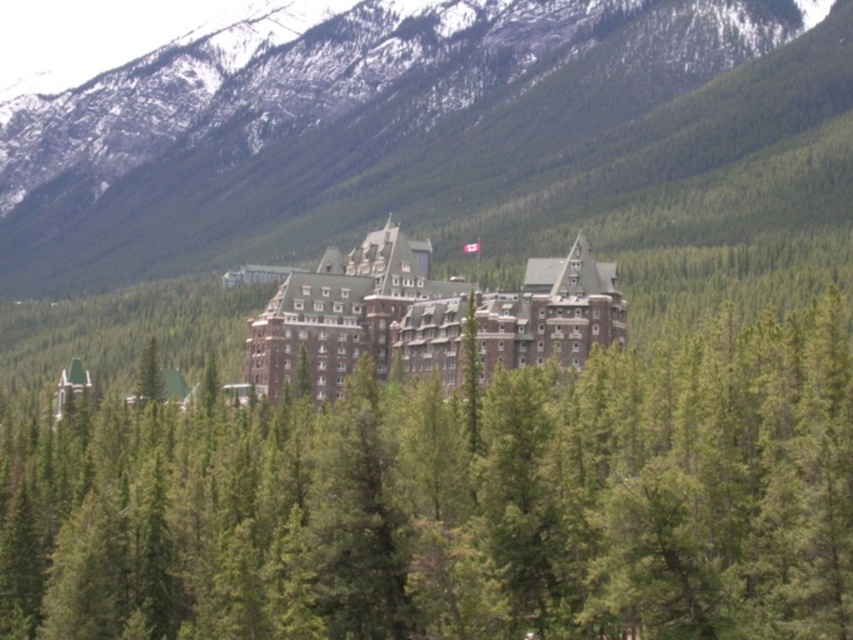
Question: Is green forested mountain at upper center to the right of brown brick hotel at center from the viewer's perspective?

Choices:
 (A) yes
 (B) no

Answer: (B)

Question: Which point is closer to the camera?

Choices:
 (A) (260, 182)
 (B) (44, 440)
 (C) (440, 300)

Answer: (B)

Question: Which of the following is the closest to the observer?

Choices:
 (A) green textured tree at center
 (B) brown brick hotel at center

Answer: (A)

Question: Is green textured tree at center further to the viewer compared to brown brick hotel at center?

Choices:
 (A) no
 (B) yes

Answer: (A)

Question: Among these objects, which one is nearest to the camera?

Choices:
 (A) green textured tree at center
 (B) brown brick hotel at center

Answer: (A)

Question: Can you confirm if green textured tree at center is wider than green forested mountain at upper center?

Choices:
 (A) yes
 (B) no

Answer: (B)